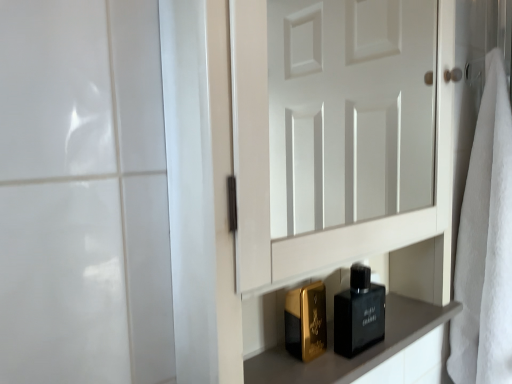
You are a GUI agent. You are given a task and a screenshot of the screen. Output one action in this format:
    pyautogui.click(x=<x>, y=<y>)
    Task: Click on the free spot to the right of black glass perfume at lower center
    Image resolution: width=512 pixels, height=384 pixels.
    Given the screenshot: What is the action you would take?
    pyautogui.click(x=408, y=326)